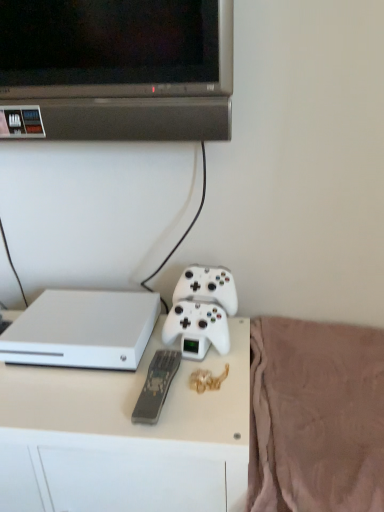
Question: From the image's perspective, does gray matte remote at center appear lower than white plastic desk at center?

Choices:
 (A) yes
 (B) no

Answer: (B)

Question: Considering the relative sizes of gray matte remote at center and white plastic desk at center in the image provided, is gray matte remote at center taller than white plastic desk at center?

Choices:
 (A) yes
 (B) no

Answer: (B)

Question: Is gray matte remote at center to the right of white plastic desk at center from the viewer's perspective?

Choices:
 (A) no
 (B) yes

Answer: (B)

Question: Can we say gray matte remote at center lies outside white plastic desk at center?

Choices:
 (A) no
 (B) yes

Answer: (A)

Question: Does gray matte remote at center have a smaller size compared to white plastic desk at center?

Choices:
 (A) yes
 (B) no

Answer: (A)

Question: Would you say gray matte remote at center is to the left or to the right of white matte game controller at center in the picture?

Choices:
 (A) left
 (B) right

Answer: (A)

Question: From the image's perspective, is gray matte remote at center located above or below white matte game controller at center?

Choices:
 (A) below
 (B) above

Answer: (A)

Question: Is gray matte remote at center taller or shorter than white matte game controller at center?

Choices:
 (A) tall
 (B) short

Answer: (B)

Question: Relative to white matte game controller at center, is gray matte remote at center in front or behind?

Choices:
 (A) front
 (B) behind

Answer: (A)

Question: Is pink soft fabric at lower right wider or thinner than gray matte remote at center?

Choices:
 (A) wide
 (B) thin

Answer: (A)

Question: From their relative heights in the image, would you say pink soft fabric at lower right is taller or shorter than gray matte remote at center?

Choices:
 (A) tall
 (B) short

Answer: (A)

Question: Considering the positions of point (329, 440) and point (145, 399), is point (329, 440) closer or farther from the camera than point (145, 399)?

Choices:
 (A) closer
 (B) farther

Answer: (B)

Question: From the image's perspective, is pink soft fabric at lower right located above or below gray matte remote at center?

Choices:
 (A) above
 (B) below

Answer: (B)

Question: Looking at their shapes, would you say white plastic desk at center is wider or thinner than gray matte remote at center?

Choices:
 (A) thin
 (B) wide

Answer: (B)

Question: Considering the positions of white plastic desk at center and gray matte remote at center in the image, is white plastic desk at center bigger or smaller than gray matte remote at center?

Choices:
 (A) small
 (B) big

Answer: (B)